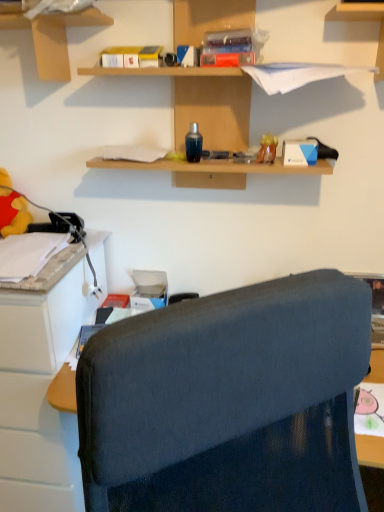
Measure the distance between point [233,102] and camera.

Point [233,102] is 4.43 feet from camera.

What is the approximate height of matte plastic toy at upper right, which is the second toy in back-to-front order?

matte plastic toy at upper right, which is the second toy in back-to-front order, is 3.30 inches in height.

This screenshot has height=512, width=384. Describe the element at coordinates (267, 149) in the screenshot. I see `matte plastic toy at upper right, the 1th toy positioned from the right` at that location.

Find the location of a particular element. This screenshot has width=384, height=512. white plastic cabinet at left is located at coordinates (42, 388).

Identify the location of yellow plush toy at left, the second toy when ordered from right to left. This screenshot has height=512, width=384. pyautogui.click(x=13, y=213).

Identify the location of wooden shelves at upper center, acting as the first shelf starting from the right. The height and width of the screenshot is (512, 384). (216, 103).

Between wooden shelves at upper center, acting as the first shelf starting from the right, and yellow plush toy at left, which is counted as the second toy, starting from the front, which one has smaller size?

Smaller between the two is yellow plush toy at left, which is counted as the second toy, starting from the front.

Which point is more forward, (131, 39) or (17, 201)?

Point (131, 39)

From a real-world perspective, count 1st shelfs upward from the yellow plush toy at left, marked as the 1th toy in a back-to-front arrangement, and point to it. Please provide its 2D coordinates.

[(216, 103)]

Is wooden shelves at upper center, which is counted as the second shelf, starting from the left, not close to yellow plush toy at left, marked as the 1th toy in a back-to-front arrangement?

That's not correct — wooden shelves at upper center, which is counted as the second shelf, starting from the left, is a little close to yellow plush toy at left, marked as the 1th toy in a back-to-front arrangement.

Which is behind, white plastic cabinet at left or matte plastic toy at upper right, which is counted as the first toy, starting from the front?

matte plastic toy at upper right, which is counted as the first toy, starting from the front, is further from the camera.

Is white plastic cabinet at left facing towards matte plastic toy at upper right, which is counted as the first toy, starting from the front?

No, white plastic cabinet at left is not facing towards matte plastic toy at upper right, which is counted as the first toy, starting from the front.

Considering the sizes of white plastic cabinet at left and matte plastic toy at upper right, the 1th toy positioned from the right, in the image, is white plastic cabinet at left wider or thinner than matte plastic toy at upper right, the 1th toy positioned from the right,?

Considering their sizes, white plastic cabinet at left looks broader than matte plastic toy at upper right, the 1th toy positioned from the right.

Consider the image. From a real-world perspective, is matte plastic toy at upper right, the 1th toy positioned from the right, above or below white plastic cabinet at left?

matte plastic toy at upper right, the 1th toy positioned from the right, is above white plastic cabinet at left.

Is matte plastic toy at upper right, which is the second toy in back-to-front order, with white plastic cabinet at left?

No, matte plastic toy at upper right, which is the second toy in back-to-front order, is not beside white plastic cabinet at left.

From a real-world perspective, which toy is the 2nd one above the white plastic cabinet at left? Please provide its 2D coordinates.

[(267, 149)]

Which of these two, matte plastic toy at upper right, which is the second toy in back-to-front order, or white plastic cabinet at left, is bigger?

white plastic cabinet at left.

Based on the photo, does matte cardboard box at upper left, placed as the second shelf when sorted from right to left, have a greater height compared to white plastic cabinet at left?

In fact, matte cardboard box at upper left, placed as the second shelf when sorted from right to left, may be shorter than white plastic cabinet at left.

At what (x,y) coordinates should I click in order to perform the action: click on shelf that is the 2nd object above the white plastic cabinet at left (from a real-world perspective). Please return your answer as a coordinate pair (x, y). This screenshot has width=384, height=512. Looking at the image, I should click on (78, 18).

From a real-world perspective, relative to white plastic cabinet at left, is matte cardboard box at upper left, arranged as the 1th shelf when viewed from the left, vertically above or below?

matte cardboard box at upper left, arranged as the 1th shelf when viewed from the left, is above white plastic cabinet at left.

Can you confirm if matte cardboard box at upper left, arranged as the 1th shelf when viewed from the left, is bigger than white plastic cabinet at left?

No, matte cardboard box at upper left, arranged as the 1th shelf when viewed from the left, is not bigger than white plastic cabinet at left.

Which of these two, matte plastic toy at upper right, the 1th toy positioned from the right, or matte cardboard box at upper left, arranged as the 1th shelf when viewed from the left, is bigger?

With larger size is matte cardboard box at upper left, arranged as the 1th shelf when viewed from the left.

Can you tell me how much matte plastic toy at upper right, which is counted as the first toy, starting from the front, and matte cardboard box at upper left, arranged as the 1th shelf when viewed from the left, differ in facing direction?

2.85 degrees.

Is matte plastic toy at upper right, which ranks as the second toy in left-to-right order, positioned in front of matte cardboard box at upper left, placed as the second shelf when sorted from right to left?

No, it is not.

Which object is thinner, matte plastic toy at upper right, the 1th toy positioned from the right, or matte cardboard box at upper left, placed as the second shelf when sorted from right to left?

matte plastic toy at upper right, the 1th toy positioned from the right.

Is wooden shelves at upper center, acting as the first shelf starting from the right, bigger than white plastic cabinet at left?

Incorrect, wooden shelves at upper center, acting as the first shelf starting from the right, is not larger than white plastic cabinet at left.

In the scene shown: Does wooden shelves at upper center, acting as the first shelf starting from the right, have a greater width compared to white plastic cabinet at left?

No, wooden shelves at upper center, acting as the first shelf starting from the right, is not wider than white plastic cabinet at left.

Considering the relative positions of wooden shelves at upper center, which is counted as the second shelf, starting from the left, and white plastic cabinet at left in the image provided, is wooden shelves at upper center, which is counted as the second shelf, starting from the left, to the left or to the right of white plastic cabinet at left?

In the image, wooden shelves at upper center, which is counted as the second shelf, starting from the left, appears on the right side of white plastic cabinet at left.

Is white plastic cabinet at left facing away from wooden shelves at upper center, which is counted as the second shelf, starting from the left?

That's not correct — white plastic cabinet at left is not looking away from wooden shelves at upper center, which is counted as the second shelf, starting from the left.

Does white plastic cabinet at left have a larger size compared to wooden shelves at upper center, acting as the first shelf starting from the right?

Indeed, white plastic cabinet at left has a larger size compared to wooden shelves at upper center, acting as the first shelf starting from the right.

Is white plastic cabinet at left directly adjacent to wooden shelves at upper center, which is counted as the second shelf, starting from the left?

No, white plastic cabinet at left is not next to wooden shelves at upper center, which is counted as the second shelf, starting from the left.

I want to click on toy on the left side of wooden shelves at upper center, acting as the first shelf starting from the right, so click(x=13, y=213).

From the white plastic cabinet at left, count 1st toys backward and point to it. Please provide its 2D coordinates.

[(267, 149)]

Considering their positions, is wooden shelves at upper center, which is counted as the second shelf, starting from the left, positioned further to yellow plush toy at left, marked as the 1th toy in a back-to-front arrangement, than matte cardboard box at upper left, arranged as the 1th shelf when viewed from the left?

wooden shelves at upper center, which is counted as the second shelf, starting from the left, lies further to yellow plush toy at left, marked as the 1th toy in a back-to-front arrangement, than the other object.

Which object lies further to the anchor point matte cardboard box at upper left, placed as the second shelf when sorted from right to left, yellow plush toy at left, marked as the 1th toy in a left-to-right arrangement, or white plastic cabinet at left?

white plastic cabinet at left is positioned further to the anchor matte cardboard box at upper left, placed as the second shelf when sorted from right to left.

Estimate the real-world distances between objects in this image. Which object is closer to matte cardboard box at upper left, placed as the second shelf when sorted from right to left, wooden shelves at upper center, which is counted as the second shelf, starting from the left, or white plastic cabinet at left?

wooden shelves at upper center, which is counted as the second shelf, starting from the left, lies closer to matte cardboard box at upper left, placed as the second shelf when sorted from right to left, than the other object.

Based on their spatial positions, is white plastic cabinet at left or wooden shelves at upper center, acting as the first shelf starting from the right, further from yellow plush toy at left, which is counted as the second toy, starting from the front?

The object further to yellow plush toy at left, which is counted as the second toy, starting from the front, is wooden shelves at upper center, acting as the first shelf starting from the right.

Based on the photo, looking at the image, which one is located further to matte plastic toy at upper right, which ranks as the second toy in left-to-right order, wooden shelves at upper center, acting as the first shelf starting from the right, or white plastic cabinet at left?

white plastic cabinet at left is further to matte plastic toy at upper right, which ranks as the second toy in left-to-right order.

Estimate the real-world distances between objects in this image. Which object is further from matte plastic toy at upper right, which is the second toy in back-to-front order, yellow plush toy at left, marked as the 1th toy in a back-to-front arrangement, or wooden shelves at upper center, which is counted as the second shelf, starting from the left?

yellow plush toy at left, marked as the 1th toy in a back-to-front arrangement.

When comparing their distances from matte plastic toy at upper right, which ranks as the second toy in left-to-right order, does matte cardboard box at upper left, placed as the second shelf when sorted from right to left, or yellow plush toy at left, marked as the 1th toy in a left-to-right arrangement, seem closer?

The object closer to matte plastic toy at upper right, which ranks as the second toy in left-to-right order, is matte cardboard box at upper left, placed as the second shelf when sorted from right to left.

Estimate the real-world distances between objects in this image. Which object is further from yellow plush toy at left, marked as the 1th toy in a back-to-front arrangement, matte cardboard box at upper left, arranged as the 1th shelf when viewed from the left, or white plastic cabinet at left?

matte cardboard box at upper left, arranged as the 1th shelf when viewed from the left, lies further to yellow plush toy at left, marked as the 1th toy in a back-to-front arrangement, than the other object.

The width and height of the screenshot is (384, 512). Find the location of `shelf between yellow plush toy at left, the second toy when ordered from right to left, and wooden shelves at upper center, which is counted as the second shelf, starting from the left`. shelf between yellow plush toy at left, the second toy when ordered from right to left, and wooden shelves at upper center, which is counted as the second shelf, starting from the left is located at coordinates (78, 18).

Image resolution: width=384 pixels, height=512 pixels. I want to click on cabinetry between yellow plush toy at left, marked as the 1th toy in a left-to-right arrangement, and matte plastic toy at upper right, which ranks as the second toy in left-to-right order, so click(x=42, y=388).

Where is `shelf between matte cardboard box at upper left, placed as the second shelf when sorted from right to left, and white plastic cabinet at left, in the vertical direction`? shelf between matte cardboard box at upper left, placed as the second shelf when sorted from right to left, and white plastic cabinet at left, in the vertical direction is located at coordinates [216, 103].

The height and width of the screenshot is (512, 384). Find the location of `shelf between matte cardboard box at upper left, arranged as the 1th shelf when viewed from the left, and matte plastic toy at upper right, which ranks as the second toy in left-to-right order`. shelf between matte cardboard box at upper left, arranged as the 1th shelf when viewed from the left, and matte plastic toy at upper right, which ranks as the second toy in left-to-right order is located at coordinates (216, 103).